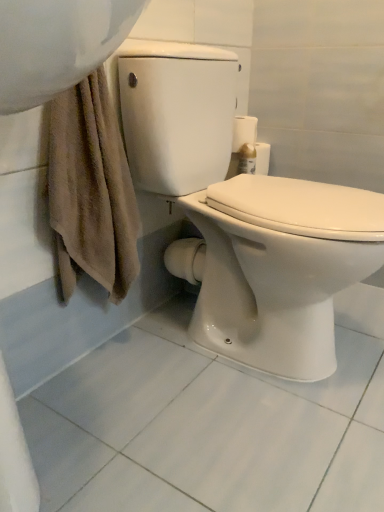
Question: Can you confirm if white glossy toilet at center is smaller than white glossy toilet paper at upper right?

Choices:
 (A) no
 (B) yes

Answer: (A)

Question: Does white glossy toilet at center contain white glossy toilet paper at upper right?

Choices:
 (A) no
 (B) yes

Answer: (A)

Question: Considering the relative positions of white glossy toilet at center and white glossy toilet paper at upper right in the image provided, is white glossy toilet at center to the right of white glossy toilet paper at upper right from the viewer's perspective?

Choices:
 (A) no
 (B) yes

Answer: (A)

Question: Considering the relative positions of white glossy toilet at center and white glossy toilet paper at upper right in the image provided, is white glossy toilet at center to the left of white glossy toilet paper at upper right from the viewer's perspective?

Choices:
 (A) no
 (B) yes

Answer: (B)

Question: Is white glossy toilet at center not close to white glossy toilet paper at upper right?

Choices:
 (A) yes
 (B) no

Answer: (B)

Question: Considering the relative sizes of white glossy toilet at center and white glossy toilet paper at upper right in the image provided, is white glossy toilet at center thinner than white glossy toilet paper at upper right?

Choices:
 (A) yes
 (B) no

Answer: (B)

Question: Is white glossy toilet paper at upper right positioned far away from white glossy toilet at center?

Choices:
 (A) no
 (B) yes

Answer: (A)

Question: Can you confirm if white glossy toilet paper at upper right is bigger than white glossy toilet at center?

Choices:
 (A) yes
 (B) no

Answer: (B)

Question: Is white glossy toilet paper at upper right located outside white glossy toilet at center?

Choices:
 (A) no
 (B) yes

Answer: (B)

Question: From a real-world perspective, is white glossy toilet paper at upper right physically above white glossy toilet at center?

Choices:
 (A) yes
 (B) no

Answer: (A)

Question: Does white glossy toilet paper at upper right come behind white glossy toilet at center?

Choices:
 (A) no
 (B) yes

Answer: (B)

Question: From the image's perspective, is white glossy toilet paper at upper right located beneath white glossy toilet at center?

Choices:
 (A) no
 (B) yes

Answer: (A)

Question: Considering the positions of white glossy toilet paper at upper right and white glossy toilet at center in the image, is white glossy toilet paper at upper right wider or thinner than white glossy toilet at center?

Choices:
 (A) wide
 (B) thin

Answer: (B)